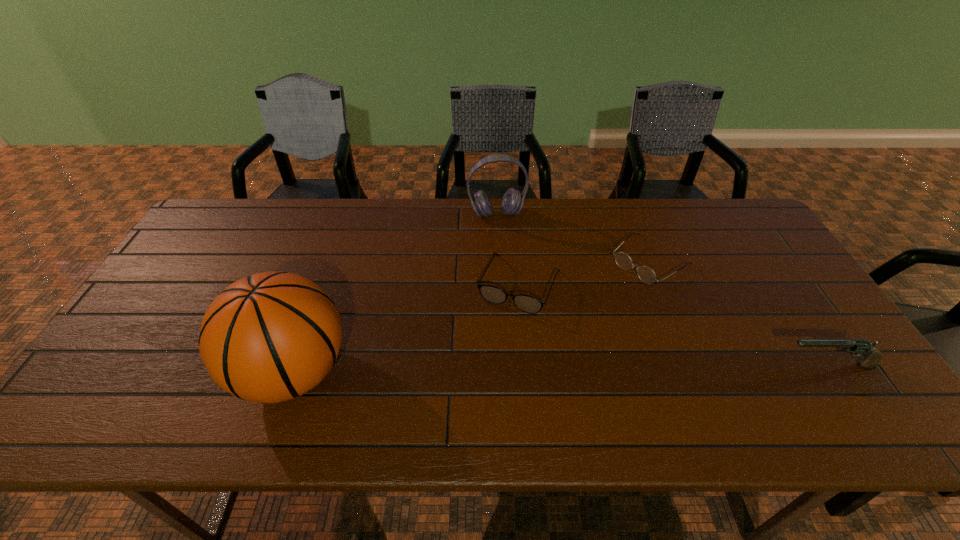
Where is `vacant space on the desktop that is between the leftmost object and the gun and is positioned through the lenses of the second object from right to left`? This screenshot has height=540, width=960. vacant space on the desktop that is between the leftmost object and the gun and is positioned through the lenses of the second object from right to left is located at coordinates (514, 369).

I want to click on free space on the desktop that is between the leftmost object and the rightmost object and is positioned on the headband and ear cups of the farthest object, so click(x=532, y=369).

This screenshot has width=960, height=540. I want to click on vacant space on the desktop that is between the basketball and the rightmost object and is positioned on the front-facing side of the left spectacles, so click(483, 370).